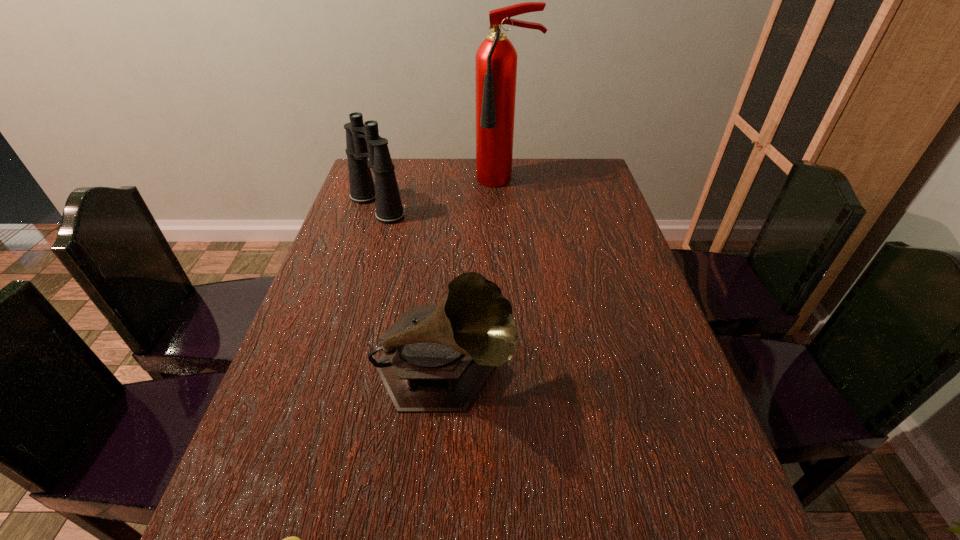
In the image, there is a desktop. At what (x,y) coordinates should I click in order to perform the action: click on vacant area at the left edge. Please return your answer as a coordinate pair (x, y). Looking at the image, I should click on tap(269, 489).

The image size is (960, 540). What are the coordinates of `free space at the right edge` in the screenshot? It's located at (580, 244).

The height and width of the screenshot is (540, 960). In the image, there is a desktop. Find the location of `vacant space at the far right corner`. vacant space at the far right corner is located at coordinates (593, 190).

The height and width of the screenshot is (540, 960). Identify the location of free spot between the binoculars and the fire extinguisher. (441, 194).

At what (x,y) coordinates should I click in order to perform the action: click on empty location between the binoculars and the tallest object. Please return your answer as a coordinate pair (x, y). The height and width of the screenshot is (540, 960). Looking at the image, I should click on (441, 194).

Find the location of a particular element. The height and width of the screenshot is (540, 960). free point between the tallest object and the binoculars is located at coordinates (441, 194).

The image size is (960, 540). I want to click on the closest object to the phonograph record, so click(x=290, y=539).

Identify which object is located as the second nearest to the phonograph record. Please provide its 2D coordinates. Your answer should be formatted as a tuple, i.e. [(x, y)], where the tuple contains the x and y coordinates of a point satisfying the conditions above.

[(363, 141)]

Locate an element on the screen. This screenshot has height=540, width=960. free spot that satisfies the following two spatial constraints: 1. at the nozzle of the fire extinguisher; 2. on the horn direction of the third farthest object is located at coordinates (521, 373).

Where is `vacant region that satisfies the following two spatial constraints: 1. at the nozzle of the fire extinguisher; 2. on the horn direction of the third farthest object`? The height and width of the screenshot is (540, 960). vacant region that satisfies the following two spatial constraints: 1. at the nozzle of the fire extinguisher; 2. on the horn direction of the third farthest object is located at coordinates (521, 373).